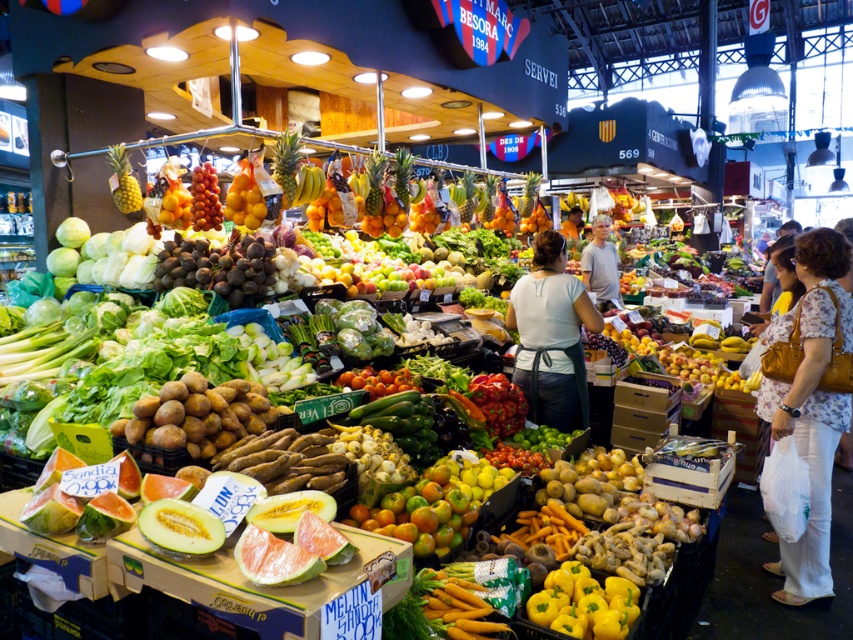
You are a customer at the market and want to buy both the floral print blouse at center and the smooth white shirt at center. However, you have a small bag that can only hold one of them. Based on their sizes, which one should you choose to fit in your bag?

The smooth white shirt at center is smaller in size than the floral print blouse at center, so you should choose the smooth white shirt at center to fit in your bag.

You are a customer at the market and want to ask the vendor about the watermelons. The vendor is wearing the white fabric apron at center. Where should you look to find the vendor?

The vendor is wearing the white fabric apron at center, so you should look towards the center of the stall to find them.